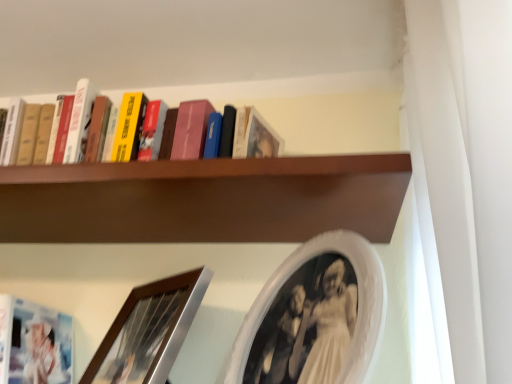
Question: Is white oval picture frame at upper center, which is the 2th picture frame in left-to-right order, surrounded by brushed silver picture frame at lower left, which is the 2th picture frame in right-to-left order?

Choices:
 (A) yes
 (B) no

Answer: (B)

Question: From a real-world perspective, is brushed silver picture frame at lower left, positioned as the first picture frame in left-to-right order, over white oval picture frame at upper center, which is the 2th picture frame in left-to-right order?

Choices:
 (A) no
 (B) yes

Answer: (A)

Question: Would you say brushed silver picture frame at lower left, positioned as the first picture frame in left-to-right order, is outside white oval picture frame at upper center, which is counted as the first picture frame, starting from the right?

Choices:
 (A) yes
 (B) no

Answer: (A)

Question: Does brushed silver picture frame at lower left, which is the 2th picture frame in right-to-left order, lie behind white oval picture frame at upper center, which is counted as the first picture frame, starting from the right?

Choices:
 (A) yes
 (B) no

Answer: (A)

Question: Is brushed silver picture frame at lower left, positioned as the first picture frame in left-to-right order, to the right of white oval picture frame at upper center, which is counted as the first picture frame, starting from the right, from the viewer's perspective?

Choices:
 (A) yes
 (B) no

Answer: (B)

Question: Is brushed silver picture frame at lower left, which is the 2th picture frame in right-to-left order, not near white oval picture frame at upper center, which is counted as the first picture frame, starting from the right?

Choices:
 (A) no
 (B) yes

Answer: (A)

Question: Is white oval picture frame at upper center, which is counted as the first picture frame, starting from the right, smaller than brown wooden shelf at upper center?

Choices:
 (A) yes
 (B) no

Answer: (A)

Question: Does white oval picture frame at upper center, which is counted as the first picture frame, starting from the right, have a greater width compared to brown wooden shelf at upper center?

Choices:
 (A) yes
 (B) no

Answer: (B)

Question: Can you confirm if white oval picture frame at upper center, which is counted as the first picture frame, starting from the right, is thinner than brown wooden shelf at upper center?

Choices:
 (A) no
 (B) yes

Answer: (B)

Question: From the image's perspective, is white oval picture frame at upper center, which is the 2th picture frame in left-to-right order, on brown wooden shelf at upper center?

Choices:
 (A) yes
 (B) no

Answer: (B)

Question: Can you confirm if white oval picture frame at upper center, which is the 2th picture frame in left-to-right order, is positioned to the left of brown wooden shelf at upper center?

Choices:
 (A) no
 (B) yes

Answer: (A)

Question: Does white oval picture frame at upper center, which is counted as the first picture frame, starting from the right, lie in front of brown wooden shelf at upper center?

Choices:
 (A) yes
 (B) no

Answer: (A)

Question: Is brown wooden shelf at upper center taller than brushed silver picture frame at lower left, positioned as the first picture frame in left-to-right order?

Choices:
 (A) yes
 (B) no

Answer: (B)